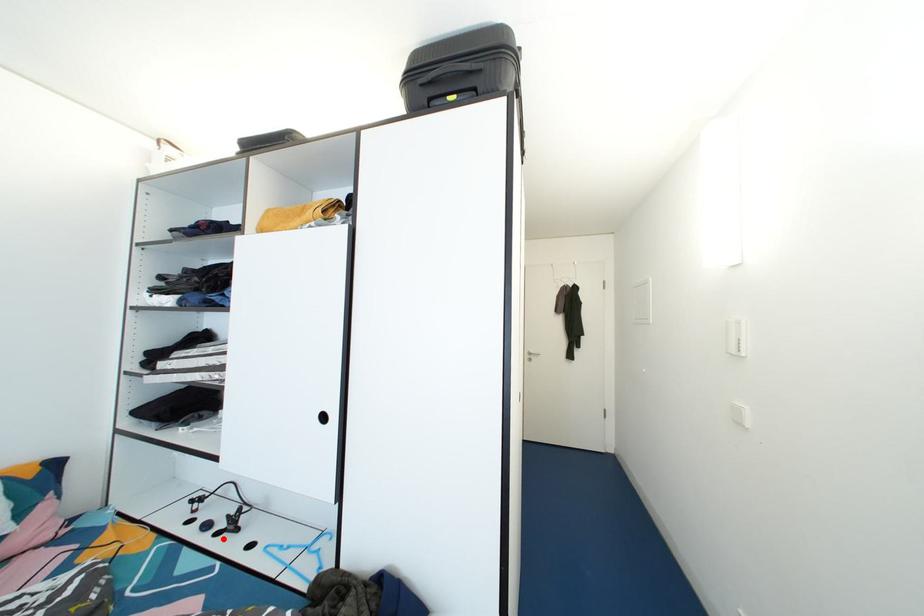
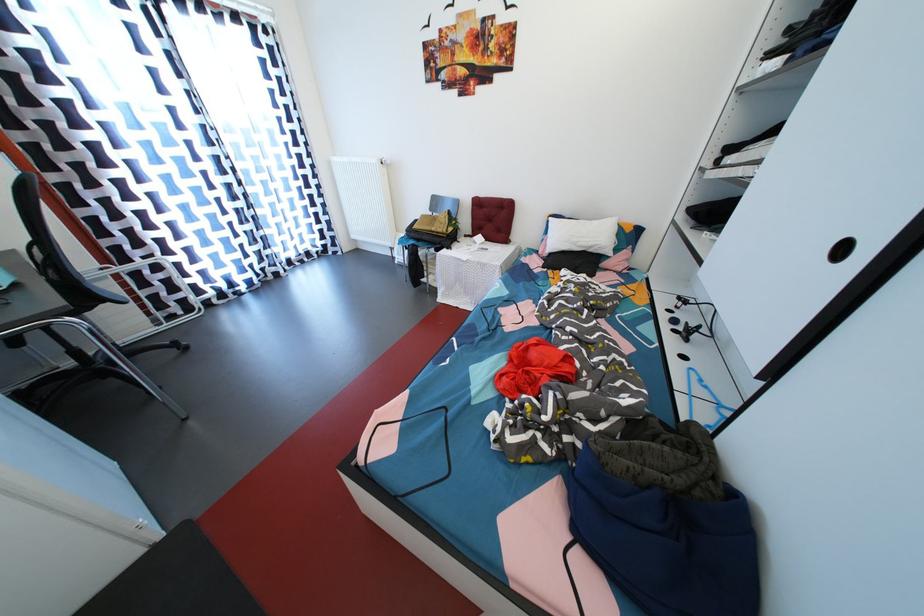
The point at the highlighted location is marked in the first image. Where is the corresponding point in the second image?

(681, 336)